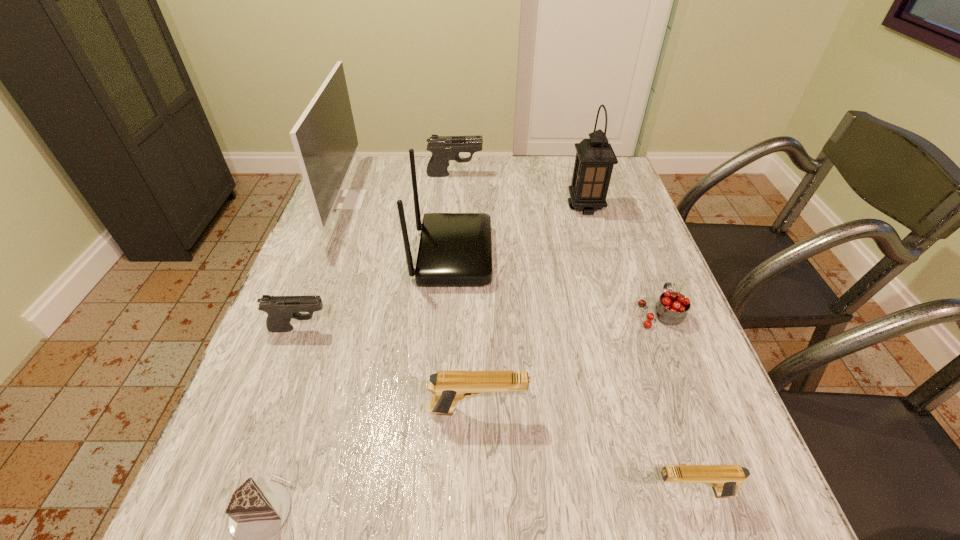
I want to click on vacant region located on the handle side of the red cherry, so click(628, 231).

Where is `free region located 0.270m at the barrel of the shortest pistol`? The height and width of the screenshot is (540, 960). free region located 0.270m at the barrel of the shortest pistol is located at coordinates (485, 492).

I want to click on free spot located 0.170m at the barrel of the shortest pistol, so click(x=546, y=492).

Find the location of a particular element. free space located 0.370m at the barrel of the shortest pistol is located at coordinates (423, 492).

The width and height of the screenshot is (960, 540). In order to click on monitor at the far edge in this screenshot , I will do `click(324, 138)`.

Find the location of a particular element. The image size is (960, 540). pistol that is at the far edge is located at coordinates coord(443,148).

What are the coordinates of `object positioned at the near edge` in the screenshot? It's located at (725, 479).

Locate an element on the screen. monitor present at the left edge is located at coordinates (324, 138).

This screenshot has height=540, width=960. Find the location of `pistol located at the left edge`. pistol located at the left edge is located at coordinates (280, 309).

I want to click on lantern positioned at the right edge, so click(x=595, y=158).